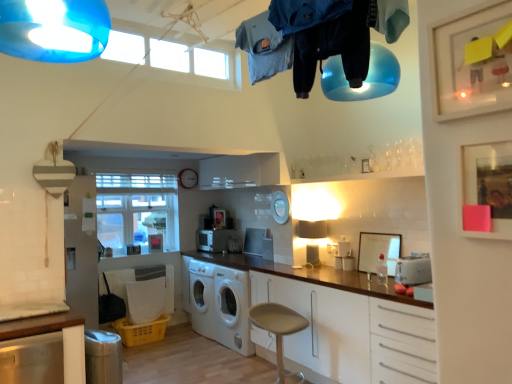
Question: From the image's perspective, is white matte washing machine at center above or below clear glass window at center?

Choices:
 (A) above
 (B) below

Answer: (B)

Question: Is white matte washing machine at center to the left or to the right of clear glass window at center in the image?

Choices:
 (A) right
 (B) left

Answer: (A)

Question: Considering the real-world distances, which object is closest to the blue cotton hoodie at upper center, acting as the third clothing starting from the back?

Choices:
 (A) white matte microwave at center, the 1th appliance in the back-to-front sequence
 (B) white matte picture frame at right, positioned as the first picture frame in back-to-front order
 (C) beige fabric stool at lower center
 (D) white plastic toaster at right, which is the 3th appliance in back-to-front order
 (E) matte pink paper at upper right, which is counted as the 1th picture frame, starting from the front

Answer: (E)

Question: Considering the real-world distances, which object is farthest from the white matte microwave at center, the 1th appliance in the left-to-right sequence?

Choices:
 (A) blue cotton hoodie at upper center, the 1th clothing in the front-to-back sequence
 (B) denim shirt at upper center, which ranks as the 1th clothing in back-to-front order
 (C) beige fabric stool at lower center
 (D) white matte washing machine at center
 (E) dark blue fabric pants at upper center, which ranks as the 2th clothing in front-to-back order

Answer: (A)